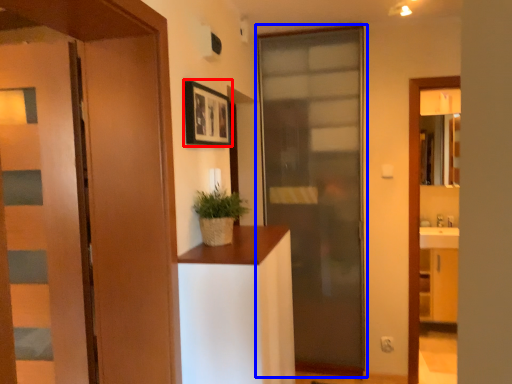
Question: Among these objects, which one is nearest to the camera, picture frame (highlighted by a red box) or door (highlighted by a blue box)?

Choices:
 (A) picture frame
 (B) door

Answer: (A)